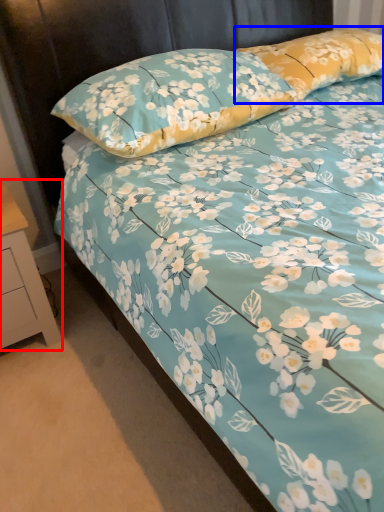
Question: Which point is further to the camera, nightstand (highlighted by a red box) or pillow (highlighted by a blue box)?

Choices:
 (A) nightstand
 (B) pillow

Answer: (B)